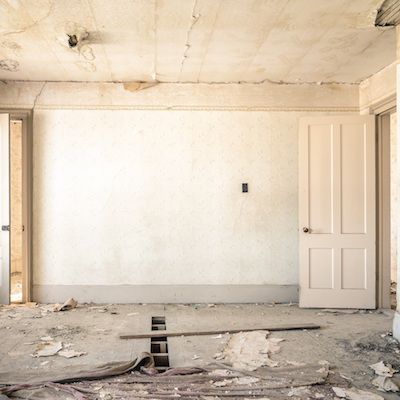
I want to click on hole in floor, so click(x=157, y=351).